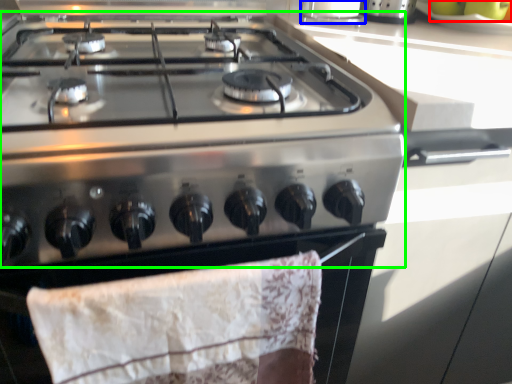
Question: Based on their relative distances, which object is farther from fruit (highlighted by a red box)? Choose from kitchen appliance (highlighted by a blue box) and gas stove (highlighted by a green box).

Choices:
 (A) kitchen appliance
 (B) gas stove

Answer: (B)